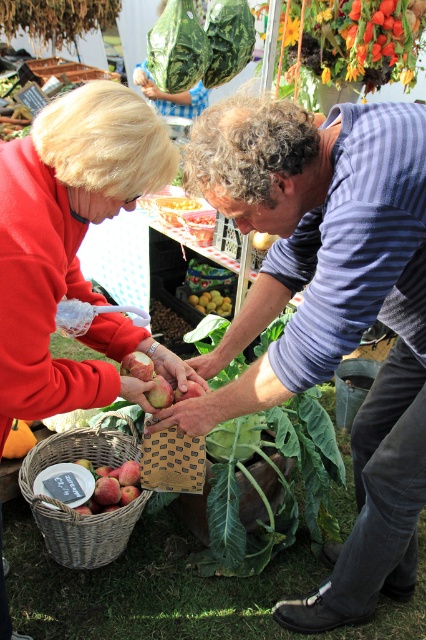
Question: Is matte red sweater at center wider than red matte apple at center?

Choices:
 (A) yes
 (B) no

Answer: (A)

Question: Considering the real-world distances, which object is farthest from the green leafy vegetable at center?

Choices:
 (A) yellow matte pears at center
 (B) red matte apple at center
 (C) matte red sweater at center

Answer: (B)

Question: Is green leafy vegetable at center positioned before red matte apple at center?

Choices:
 (A) yes
 (B) no

Answer: (B)

Question: Can you confirm if green leafy vegetable at upper center is positioned below red matte apple at lower left?

Choices:
 (A) no
 (B) yes

Answer: (A)

Question: Which object appears closest to the camera in this image?

Choices:
 (A) matte red sweater at center
 (B) red matte apple at lower left
 (C) green leafy vegetable at center

Answer: (A)

Question: Based on their relative distances, which object is farther from the green leafy vegetable at center?

Choices:
 (A) green leafy vegetable at upper center
 (B) red matte apple at lower left
 (C) woven brown basket at lower left

Answer: (B)